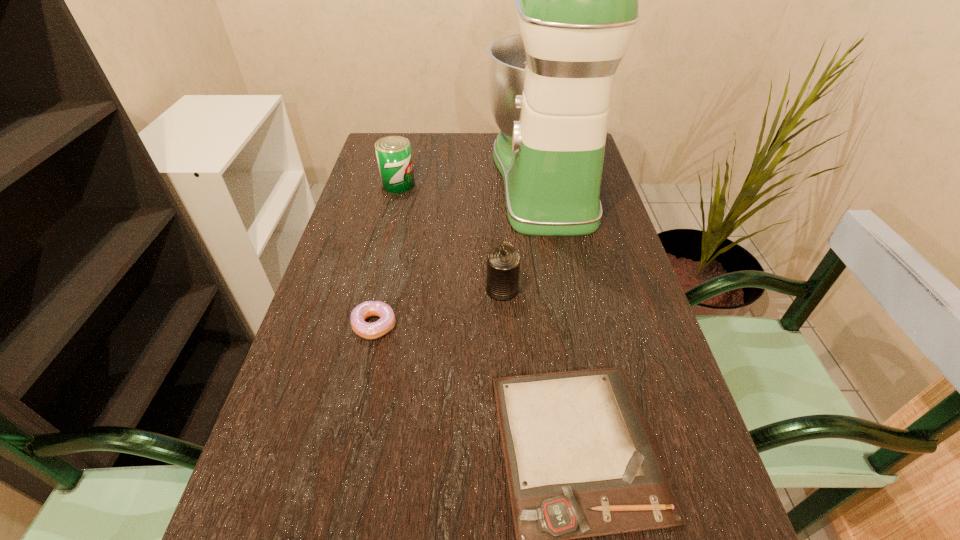
Where is `free location located 0.230m on the right of the nearer can`? The width and height of the screenshot is (960, 540). free location located 0.230m on the right of the nearer can is located at coordinates (619, 289).

You are a GUI agent. You are given a task and a screenshot of the screen. Output one action in this format:
    pyautogui.click(x=<x>, y=<y>)
    Task: Click on the free space located 0.190m on the back of the doughnut
    
    Given the screenshot: What is the action you would take?
    pyautogui.click(x=391, y=252)

This screenshot has height=540, width=960. I want to click on object that is at the far edge, so click(576, 0).

Find the location of `can located in the left edge section of the desktop`. can located in the left edge section of the desktop is located at coordinates (393, 153).

The height and width of the screenshot is (540, 960). Identify the location of doughnut present at the left edge. (387, 320).

Identify the location of object that is at the right edge. Image resolution: width=960 pixels, height=540 pixels. (576, 0).

You are a GUI agent. You are given a task and a screenshot of the screen. Output one action in this format:
    pyautogui.click(x=<x>, y=<y>)
    Task: Click on the object that is at the far right corner
    
    Given the screenshot: What is the action you would take?
    pyautogui.click(x=576, y=0)

Where is `free space at the far edge of the desktop`? Image resolution: width=960 pixels, height=540 pixels. free space at the far edge of the desktop is located at coordinates (x=438, y=165).

I want to click on vacant space at the left edge, so click(x=374, y=224).

I want to click on vacant region at the right edge of the desktop, so click(585, 326).